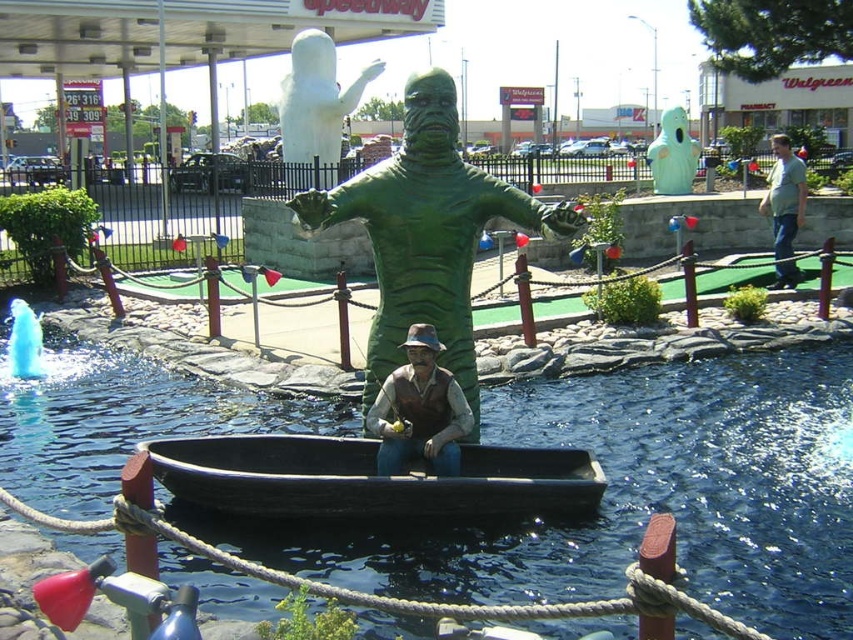
Question: Considering the real-world distances, which object is farthest from the black wood canoe at center?

Choices:
 (A) matte brown vest at center
 (B) green rubber statue at center

Answer: (B)

Question: Is matte brown vest at center above white matte ghost at upper center?

Choices:
 (A) yes
 (B) no

Answer: (B)

Question: Which object appears farthest from the camera in this image?

Choices:
 (A) light blue jeans at center right
 (B) black wood canoe at center
 (C) matte brown vest at center
 (D) black rubber boat at center

Answer: (A)

Question: Which object is positioned closest to the matte brown vest at center?

Choices:
 (A) black wood canoe at center
 (B) black rubber boat at center
 (C) teal rubber ghost at center
 (D) light blue jeans at center right

Answer: (A)

Question: In this image, where is matte brown vest at center located relative to teal rubber ghost at center?

Choices:
 (A) left
 (B) right

Answer: (A)

Question: In this image, where is light blue jeans at center right located relative to teal rubber ghost at center?

Choices:
 (A) right
 (B) left

Answer: (A)